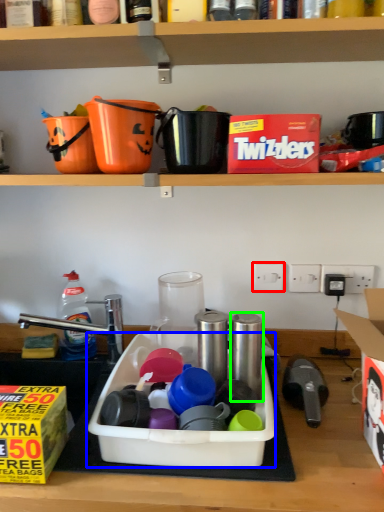
Question: Which is nearer to the electric outlet (highlighted by a red box)? sink (highlighted by a blue box) or appliance (highlighted by a green box).

Choices:
 (A) sink
 (B) appliance

Answer: (B)